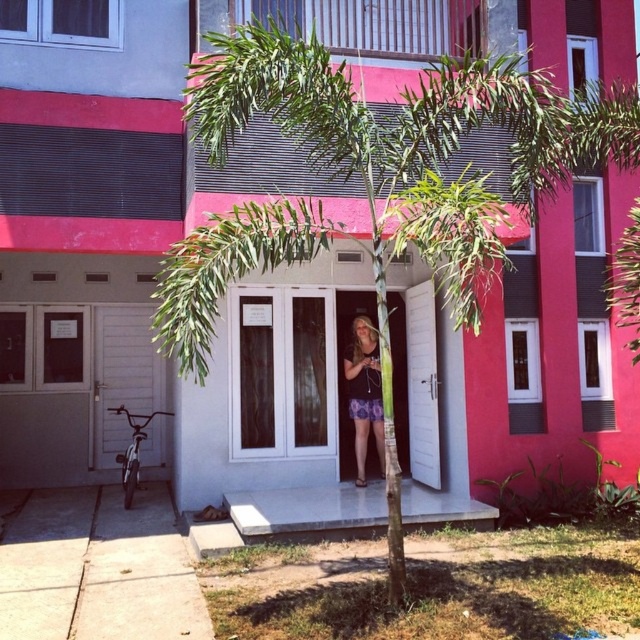
You are a photographer taking a picture of the residential building. You notice the green leafy palm tree at center and the floral skirt at center. Which object will appear larger in your photo?

The green leafy palm tree at center will appear larger in the photo because it is bigger than the floral skirt at center.

You are standing in front of the residential building and want to take a photo of the entrance without the green leafy palm tree at center blocking the view. Where should you move to relative to the tree?

The green leafy palm tree at center is located at point [394,166]. To avoid blocking the entrance in your photo, move to the side opposite of the tree.

You are standing in front of the residential building and notice the green leafy palm tree at center and the floral skirt at center. Which object is higher in the scene?

The green leafy palm tree at center is above the floral skirt at center, so it is higher in the scene.